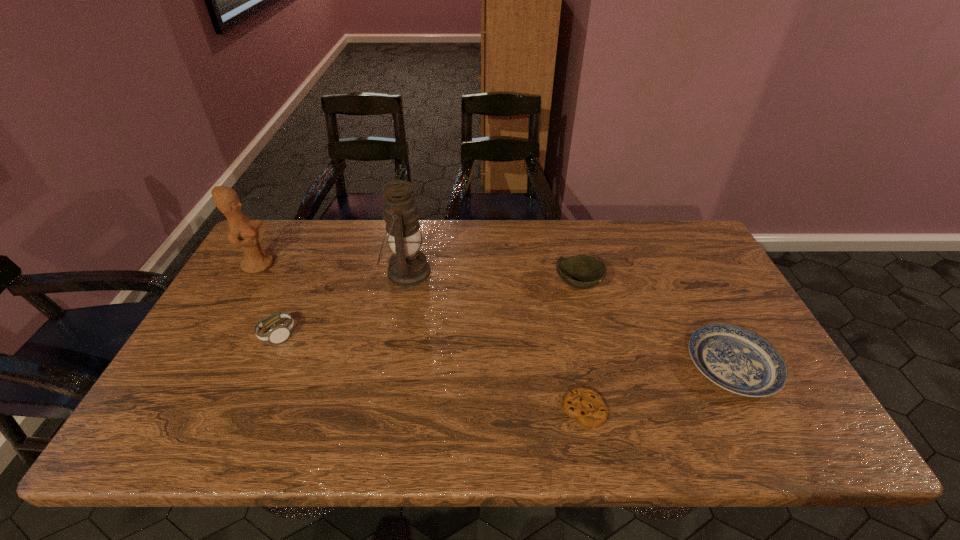
The image size is (960, 540). What are the coordinates of `oil lamp` in the screenshot? It's located at (408, 266).

What are the coordinates of `the leftmost object` in the screenshot? It's located at (243, 232).

At what (x,y) coordinates should I click in order to perform the action: click on bowl. Please return your answer as a coordinate pair (x, y). Image resolution: width=960 pixels, height=540 pixels. Looking at the image, I should click on (582, 271).

Locate an element on the screen. This screenshot has height=540, width=960. watch is located at coordinates (278, 333).

Locate an element on the screen. The width and height of the screenshot is (960, 540). plate is located at coordinates (736, 359).

This screenshot has height=540, width=960. In order to click on the rightmost object in this screenshot , I will do `click(736, 359)`.

Where is `the shortest object`? The width and height of the screenshot is (960, 540). the shortest object is located at coordinates (585, 405).

Where is `vacant space located 0.120m on the back of the fourth object from right to left`? Image resolution: width=960 pixels, height=540 pixels. vacant space located 0.120m on the back of the fourth object from right to left is located at coordinates (415, 230).

Where is `vacant space located 0.050m on the front-facing side of the figurine`? Image resolution: width=960 pixels, height=540 pixels. vacant space located 0.050m on the front-facing side of the figurine is located at coordinates (290, 265).

You are a GUI agent. You are given a task and a screenshot of the screen. Output one action in this format:
    pyautogui.click(x=<x>, y=<y>)
    Task: Click on the blank space located on the back of the bowl
    The image size is (960, 540).
    Given the screenshot: What is the action you would take?
    pyautogui.click(x=565, y=231)